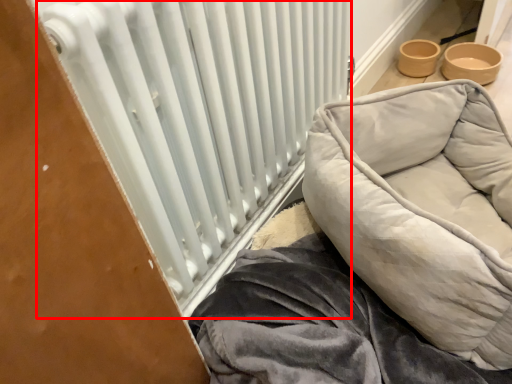
Question: From the image's perspective, considering the relative positions of radiator (annotated by the red box) and furniture in the image provided, where is radiator (annotated by the red box) located with respect to the staircase?

Choices:
 (A) above
 (B) below

Answer: (A)